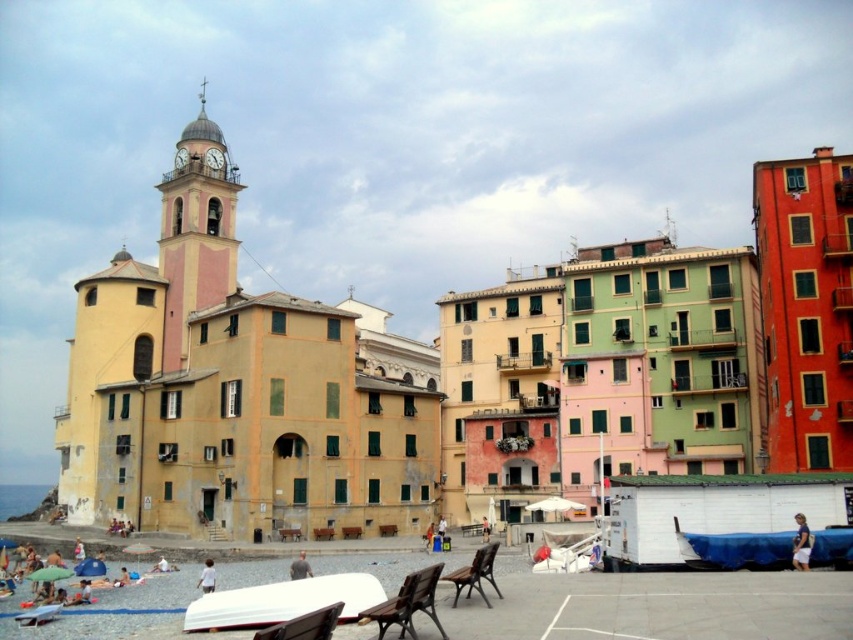
Question: Based on their relative distances, which object is nearer to the blue tarpaulin boat at lower right?

Choices:
 (A) white matte boat at center
 (B) white cotton shirt at lower right
 (C) pink fabric dress at center

Answer: (B)

Question: Can you confirm if white matte boat at lower center is positioned below white cotton shirt at lower right?

Choices:
 (A) yes
 (B) no

Answer: (A)

Question: Can you confirm if white cotton shirt at lower right is positioned to the right of smooth skin person at lower center?

Choices:
 (A) yes
 (B) no

Answer: (A)

Question: Which point appears closest to the camera in this image?

Choices:
 (A) (573, 554)
 (B) (202, 81)
 (C) (115, 586)
 (D) (299, 618)

Answer: (D)

Question: Can you confirm if brown wooden bench at lower center is positioned to the left of white cotton shirt at lower center?

Choices:
 (A) yes
 (B) no

Answer: (B)

Question: Among these objects, which one is farthest from the camera?

Choices:
 (A) white cotton shirt at lower center
 (B) white fabric umbrella at lower left

Answer: (B)